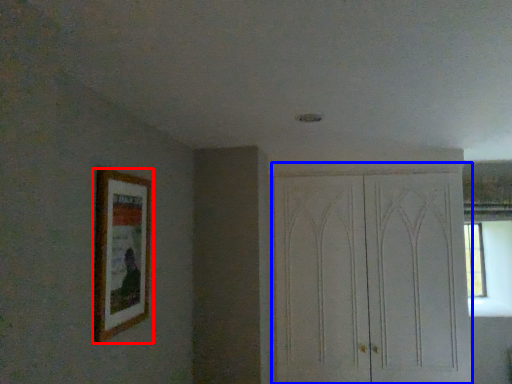
Question: Among these objects, which one is nearest to the camera, picture frame (highlighted by a red box) or dresser (highlighted by a blue box)?

Choices:
 (A) picture frame
 (B) dresser

Answer: (A)